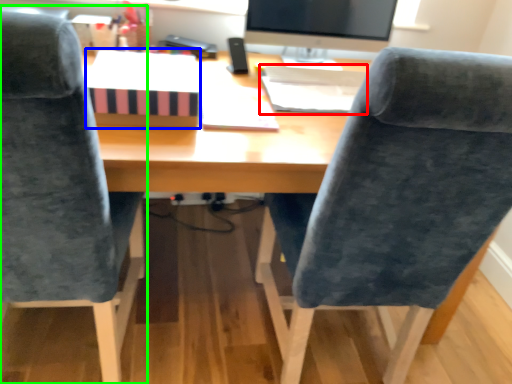
Question: Estimate the real-world distances between objects in this image. Which object is closer to book (highlighted by a red box), book (highlighted by a blue box) or chair (highlighted by a green box)?

Choices:
 (A) book
 (B) chair

Answer: (A)